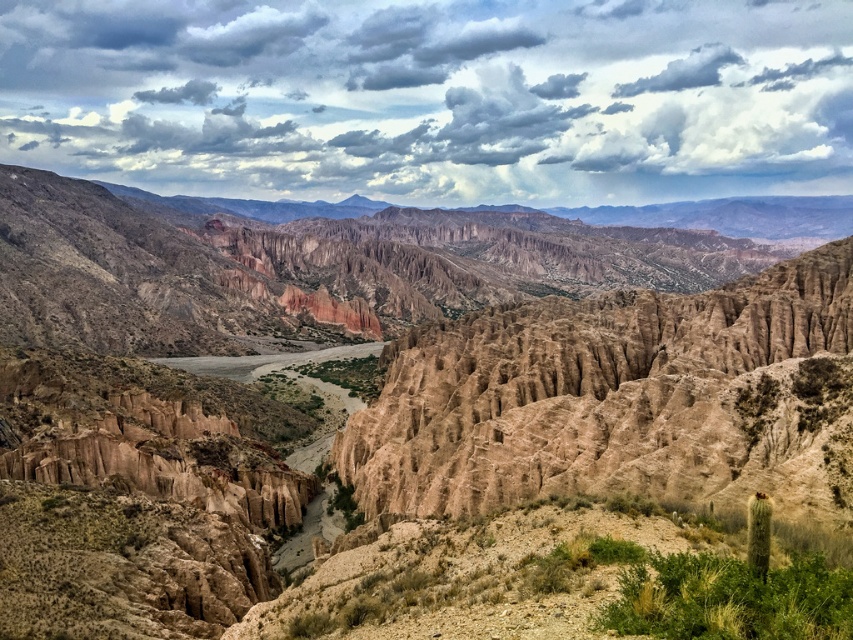
Between brown rocky terrain at center and cloudy sky at upper center, which one has less height?

brown rocky terrain at center

From the picture: Can you confirm if brown rocky terrain at center is positioned below cloudy sky at upper center?

Indeed, brown rocky terrain at center is positioned under cloudy sky at upper center.

Is point (505, 451) more distant than point (708, 179)?

That is False.

Locate an element on the screen. brown rocky terrain at center is located at coordinates (386, 374).

Who is lower down, brown rocky terrain at center or brown sandy river at center?

brown sandy river at center

Is brown rocky terrain at center positioned at the back of brown sandy river at center?

No, brown rocky terrain at center is in front of brown sandy river at center.

This screenshot has height=640, width=853. What do you see at coordinates (386, 374) in the screenshot? I see `brown rocky terrain at center` at bounding box center [386, 374].

At what (x,y) coordinates should I click in order to perform the action: click on brown rocky terrain at center. Please return your answer as a coordinate pair (x, y). This screenshot has height=640, width=853. Looking at the image, I should click on (386, 374).

Can you confirm if cloudy sky at upper center is positioned above brown sandy river at center?

Correct, cloudy sky at upper center is located above brown sandy river at center.

Is point (631, 67) positioned before point (386, 342)?

No.

At what (x,y) coordinates should I click in order to perform the action: click on cloudy sky at upper center. Please return your answer as a coordinate pair (x, y). Looking at the image, I should click on (434, 97).